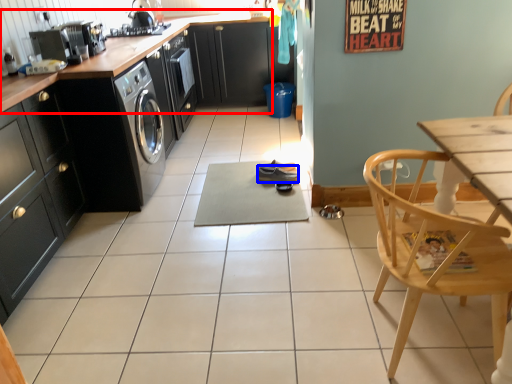
Question: Which of the following is the farthest to the observer, countertop (highlighted by a red box) or shoe (highlighted by a blue box)?

Choices:
 (A) countertop
 (B) shoe

Answer: (B)